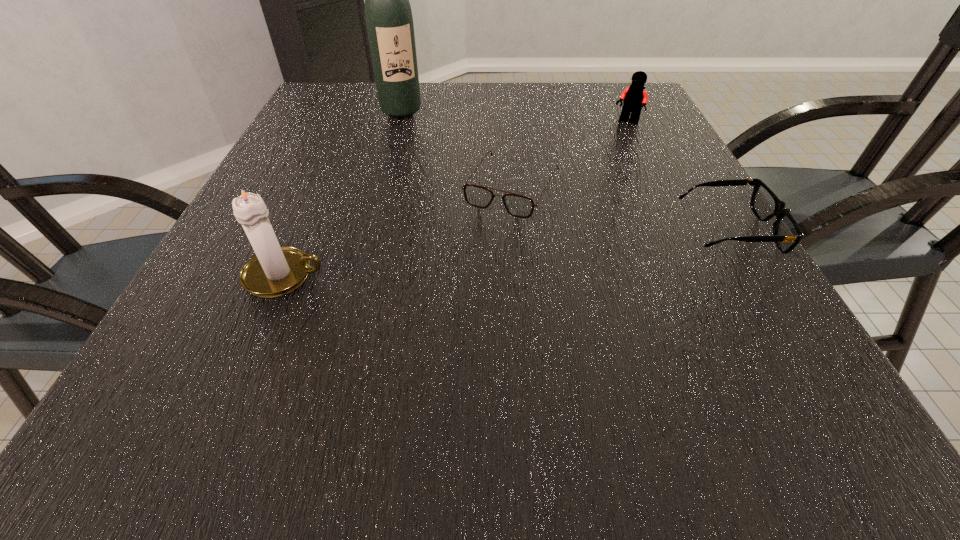
The height and width of the screenshot is (540, 960). I want to click on the second tallest object, so click(274, 271).

Where is `the leftmost object`? The image size is (960, 540). the leftmost object is located at coordinates (274, 271).

What are the coordinates of `the right sunglasses` in the screenshot? It's located at (787, 234).

The width and height of the screenshot is (960, 540). I want to click on the third shortest object, so click(x=634, y=96).

Locate an element on the screen. This screenshot has height=540, width=960. the tallest object is located at coordinates (389, 21).

What are the coordinates of `wine bottle` in the screenshot? It's located at (389, 21).

Image resolution: width=960 pixels, height=540 pixels. In order to click on the third object from left to right in this screenshot , I will do (x=521, y=206).

Locate an element on the screen. The width and height of the screenshot is (960, 540). free space located on the handle side of the fourth shortest object is located at coordinates (463, 275).

You are a GUI agent. You are given a task and a screenshot of the screen. Output one action in this format:
    pyautogui.click(x=<x>, y=<y>)
    Task: Click on the blank area located on the front-facing side of the third shortest object
    This screenshot has height=540, width=960.
    Given the screenshot: What is the action you would take?
    pyautogui.click(x=605, y=147)

Where is `vacant point located 0.340m on the front-facing side of the third shortest object`? This screenshot has width=960, height=540. vacant point located 0.340m on the front-facing side of the third shortest object is located at coordinates (564, 197).